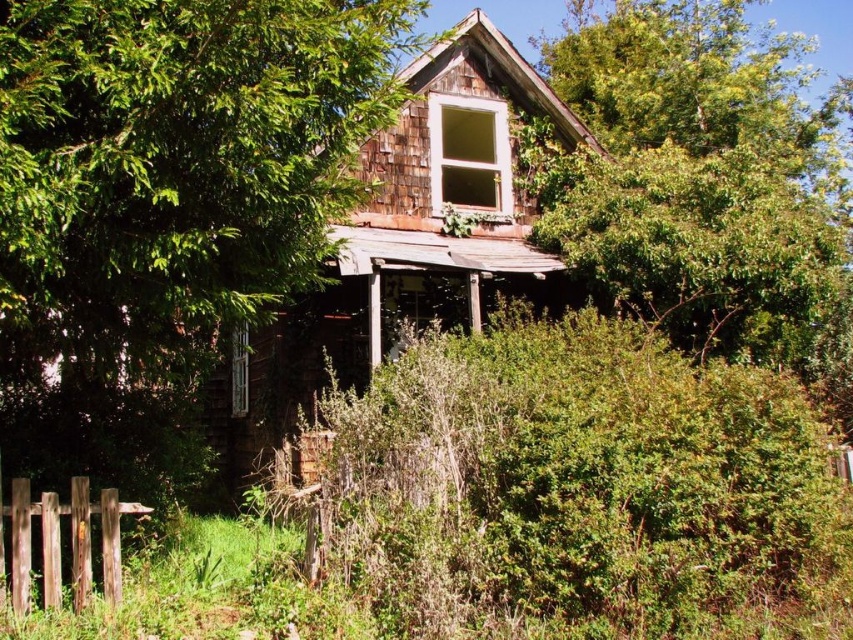
Question: Can you confirm if brown wooden fence at lower left is positioned below wooden textured window at center?

Choices:
 (A) no
 (B) yes

Answer: (B)

Question: Is green leafy tree at upper left to the left of brown wooden fence at lower left from the viewer's perspective?

Choices:
 (A) no
 (B) yes

Answer: (A)

Question: Which point is closer to the camera taking this photo?

Choices:
 (A) [x=74, y=524]
 (B) [x=466, y=166]
 (C) [x=741, y=467]

Answer: (A)

Question: Can you confirm if green leafy tree at upper left is positioned below brown wooden fence at lower left?

Choices:
 (A) yes
 (B) no

Answer: (B)

Question: Which object is the closest to the brown wooden fence at lower left?

Choices:
 (A) wooden textured window at center
 (B) white wood window at upper center

Answer: (A)

Question: Which point is farther to the camera?

Choices:
 (A) tap(85, 506)
 (B) tap(233, 198)

Answer: (A)